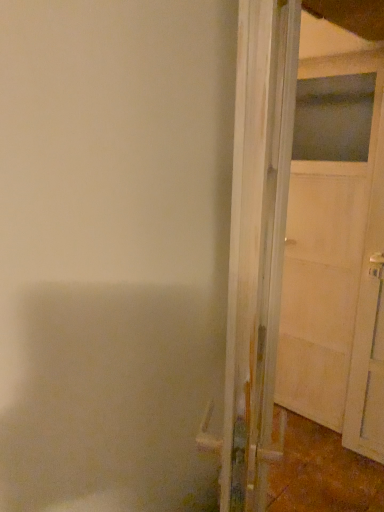
Question: From the image's perspective, is white matte door at right, the second door when ordered from left to right, positioned above or below white wood door at right, which is the first door in left-to-right order?

Choices:
 (A) below
 (B) above

Answer: (B)

Question: Relative to white wood door at right, which is the first door in left-to-right order, is white matte door at right, the second door when ordered from left to right, in front or behind?

Choices:
 (A) front
 (B) behind

Answer: (B)

Question: Would you say white matte door at right, which ranks as the first door in right-to-left order, is inside or outside white wood door at right, which is the first door in left-to-right order?

Choices:
 (A) inside
 (B) outside

Answer: (B)

Question: Would you say white wood door at right, which is the first door in left-to-right order, is inside or outside white matte door at right, which ranks as the first door in right-to-left order?

Choices:
 (A) inside
 (B) outside

Answer: (B)

Question: From a real-world perspective, is white wood door at right, which is the first door in left-to-right order, positioned above or below white matte door at right, the second door when ordered from left to right?

Choices:
 (A) below
 (B) above

Answer: (B)

Question: Is white wood door at right, which is the 2th door from right to left, to the left or to the right of white matte door at right, the second door when ordered from left to right, in the image?

Choices:
 (A) right
 (B) left

Answer: (B)

Question: Based on their sizes in the image, would you say white wood door at right, which is the 2th door from right to left, is bigger or smaller than white matte door at right, which ranks as the first door in right-to-left order?

Choices:
 (A) small
 (B) big

Answer: (B)